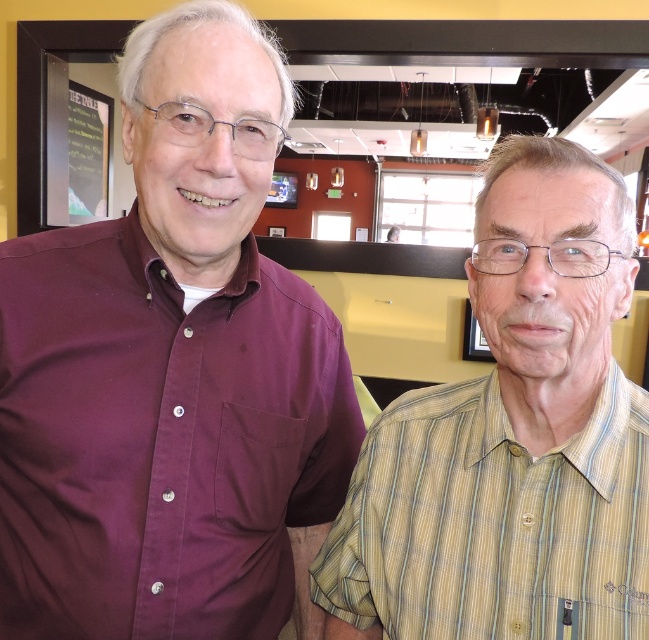
Is maroon button-up shirt at left shorter than yellow striped shirt at right?

No.

Is maroon button-up shirt at left positioned in front of yellow striped shirt at right?

No, it is behind yellow striped shirt at right.

Between point (260, 259) and point (482, 618), which one is positioned behind?

Positioned behind is point (260, 259).

The width and height of the screenshot is (649, 640). What are the coordinates of `maroon button-up shirt at left` in the screenshot? It's located at (171, 372).

Does yellow striped shirt at right come in front of green chalkboard at upper left?

Yes, yellow striped shirt at right is closer to the viewer.

Between yellow striped shirt at right and green chalkboard at upper left, which one is positioned higher?

green chalkboard at upper left is higher up.

Find the location of a particular element. yellow striped shirt at right is located at coordinates [493, 522].

The height and width of the screenshot is (640, 649). What are the coordinates of `yellow striped shirt at right` in the screenshot? It's located at (493, 522).

Measure the distance from green chalkboard at upper left to black chalkboard at upper left.

The distance of green chalkboard at upper left from black chalkboard at upper left is 37.36 inches.

Image resolution: width=649 pixels, height=640 pixels. Find the location of `green chalkboard at upper left`. green chalkboard at upper left is located at coordinates click(51, 99).

Where is `green chalkboard at upper left`? The height and width of the screenshot is (640, 649). green chalkboard at upper left is located at coordinates (51, 99).